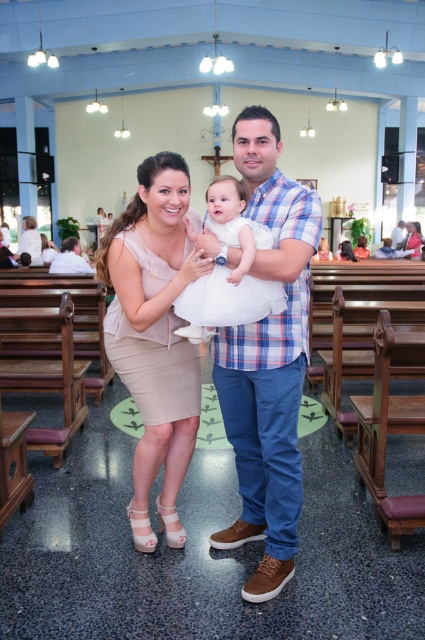
You are attending a wedding ceremony in the church and see the blue plaid shirt at center and the white tulle dress at center. From the perspective of someone standing at the entrance facing the crucifix, which clothing item is positioned to the right?

The blue plaid shirt at center is to the right of the white tulle dress at center, so from the entrance facing the crucifix, the blue plaid shirt at center is positioned to the right.

You are taking a photo of the family portrait in the church. You need to focus on two specific points in the image, point 1 at coordinates point (261, 563) and point 2 at coordinates point (169, 468). Which point should you focus on first to ensure proper depth of field?

You should focus on point 1 at coordinates point (261, 563) first because it is closer to the camera than point 2 at coordinates point (169, 468), ensuring better depth of field for the foreground elements.

You are a photographer setting up for a family photo in a church. You need to ensure that the blue plaid shirt at center and the beige satin dress at center are both visible in the frame. Given their sizes, which one might require more space to fully capture in the photo?

The beige satin dress at center is wider than the blue plaid shirt at center, so it would require more space to fully capture in the photo.